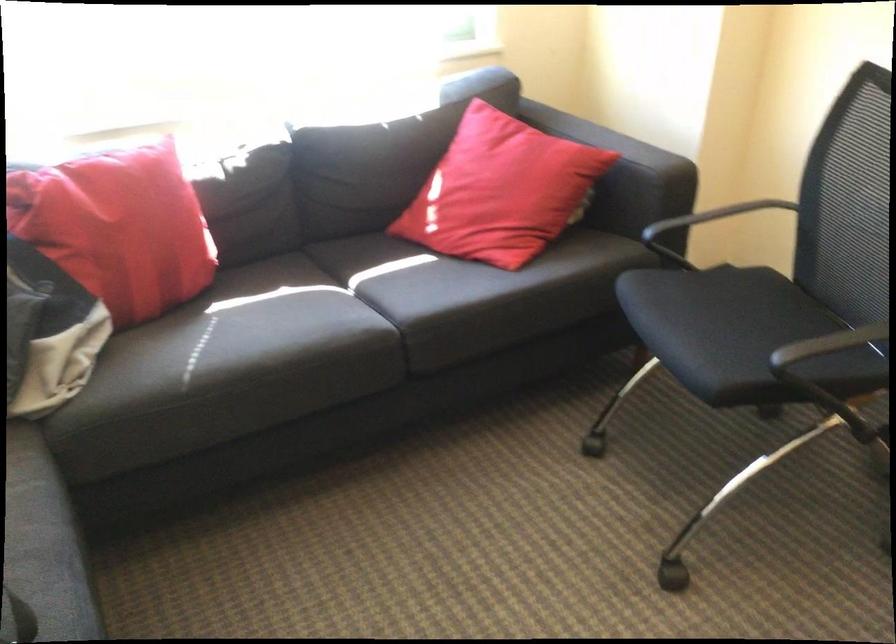
What do you see at coordinates (737, 333) in the screenshot? I see `a chair sitting surface` at bounding box center [737, 333].